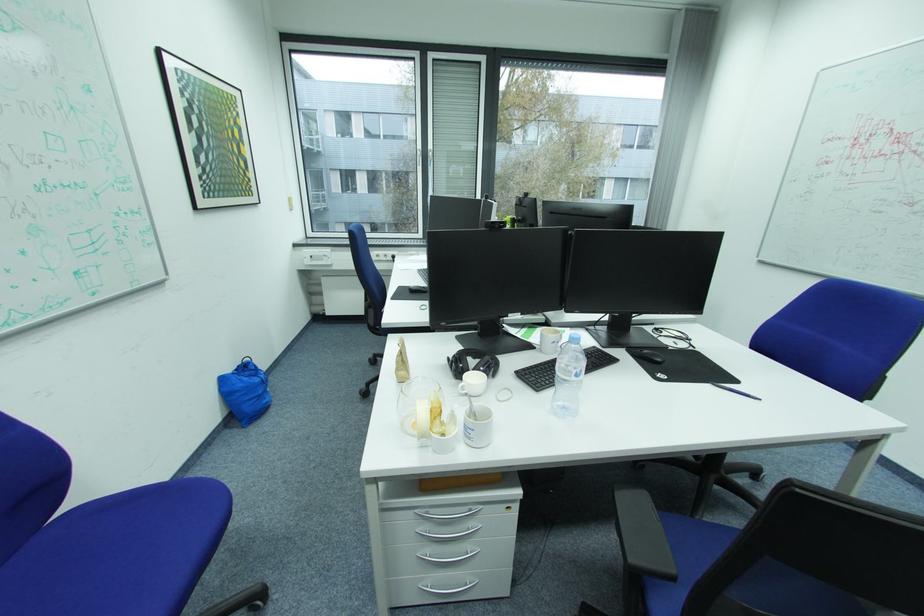
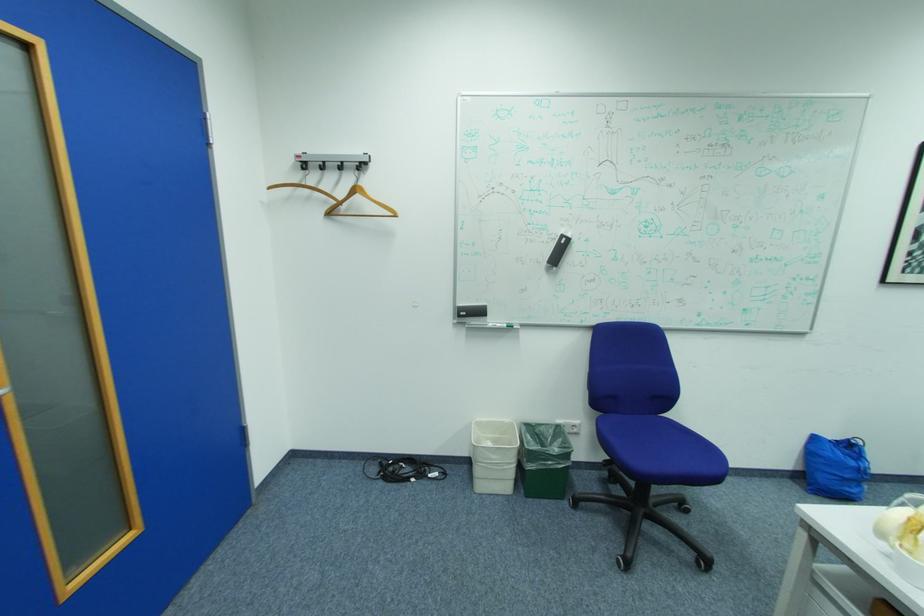
In the second image, find the point that corresponds to [249,386] in the first image.

(839, 456)